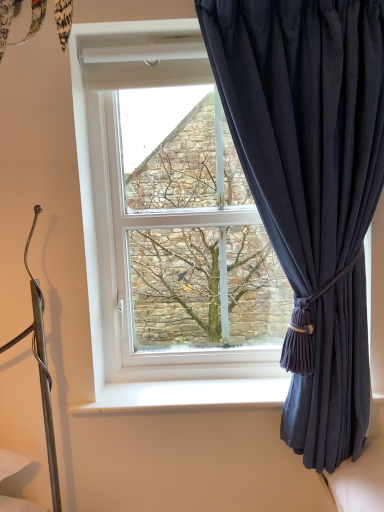
In order to click on green textured tree at center in this screenshot , I will do `click(206, 285)`.

Are green textured tree at center and dark blue fabric curtain at right far apart?

No, green textured tree at center is not far away from dark blue fabric curtain at right.

From a real-world perspective, is green textured tree at center located higher than dark blue fabric curtain at right?

Yes, from a real-world perspective, green textured tree at center is on top of dark blue fabric curtain at right.

Considering the sizes of objects green textured tree at center and dark blue fabric curtain at right in the image provided, who is shorter, green textured tree at center or dark blue fabric curtain at right?

green textured tree at center.

From the picture: Which of these two, green textured tree at center or dark blue fabric curtain at right, is bigger?

With larger size is dark blue fabric curtain at right.

Could you tell me if white plastic window sill at lower center is turned towards dark blue fabric curtain at right?

Yes, white plastic window sill at lower center is facing dark blue fabric curtain at right.

Between white plastic window sill at lower center and dark blue fabric curtain at right, which one has larger width?

Wider between the two is dark blue fabric curtain at right.

Is white plastic window sill at lower center inside or outside of dark blue fabric curtain at right?

white plastic window sill at lower center lies outside dark blue fabric curtain at right.

Is white plastic window sill at lower center closer to the viewer compared to dark blue fabric curtain at right?

No.

Is dark blue fabric curtain at right smaller than white plastic window sill at lower center?

Incorrect, dark blue fabric curtain at right is not smaller in size than white plastic window sill at lower center.

Can you tell me how much dark blue fabric curtain at right and white plastic window sill at lower center differ in facing direction?

The angular difference between dark blue fabric curtain at right and white plastic window sill at lower center is 1.59 degrees.

Is dark blue fabric curtain at right further to the viewer compared to white plastic window sill at lower center?

No, dark blue fabric curtain at right is in front of white plastic window sill at lower center.

Can you confirm if dark blue fabric curtain at right is taller than white plastic window sill at lower center?

Yes.

Does point (229, 331) lie in front of point (127, 391)?

No, (229, 331) is behind (127, 391).

From a real-world perspective, which is physically below, green textured tree at center or white plastic window sill at lower center?

Answer: white plastic window sill at lower center, from a real-world perspective.

Is green textured tree at center smaller than white plastic window sill at lower center?

No, green textured tree at center is not smaller than white plastic window sill at lower center.

At what (x,y) coordinates should I click in order to perform the action: click on window sill below the green textured tree at center (from the image's perspective). Please return your answer as a coordinate pair (x, y). The height and width of the screenshot is (512, 384). Looking at the image, I should click on (187, 395).

Is white plastic window sill at lower center taller than green textured tree at center?

No.

Which of these two, white plastic window sill at lower center or green textured tree at center, is thinner?

green textured tree at center.

Considering the sizes of objects white plastic window sill at lower center and green textured tree at center in the image provided, who is bigger, white plastic window sill at lower center or green textured tree at center?

green textured tree at center is bigger.

Looking at this image, from a real-world perspective, is white plastic window sill at lower center physically located above or below green textured tree at center?

From a real-world perspective, white plastic window sill at lower center is physically below green textured tree at center.

Is dark blue fabric curtain at right bigger or smaller than green textured tree at center?

In the image, dark blue fabric curtain at right appears to be larger than green textured tree at center.

Which is behind, point (317, 231) or point (138, 202)?

Point (138, 202)

Which of these two, dark blue fabric curtain at right or green textured tree at center, stands taller?

With more height is dark blue fabric curtain at right.

Are dark blue fabric curtain at right and green textured tree at center beside each other?

No, dark blue fabric curtain at right is not next to green textured tree at center.

This screenshot has height=512, width=384. I want to click on curtain that is below the green textured tree at center (from the image's perspective), so click(311, 188).

The image size is (384, 512). Identify the location of window sill behind the dark blue fabric curtain at right. (187, 395).

From the image, which object appears to be nearer to white plastic window sill at lower center, dark blue fabric curtain at right or green textured tree at center?

green textured tree at center lies closer to white plastic window sill at lower center than the other object.

Estimate the real-world distances between objects in this image. Which object is further from white plastic window sill at lower center, green textured tree at center or dark blue fabric curtain at right?

dark blue fabric curtain at right is further to white plastic window sill at lower center.

From the image, which object appears to be farther from dark blue fabric curtain at right, green textured tree at center or white plastic window sill at lower center?

white plastic window sill at lower center is further to dark blue fabric curtain at right.

Which object lies nearer to the anchor point dark blue fabric curtain at right, white plastic window sill at lower center or green textured tree at center?

Among the two, green textured tree at center is located nearer to dark blue fabric curtain at right.

Estimate the real-world distances between objects in this image. Which object is further from green textured tree at center, white plastic window sill at lower center or dark blue fabric curtain at right?

Among the two, white plastic window sill at lower center is located further to green textured tree at center.

From the image, which object appears to be nearer to green textured tree at center, dark blue fabric curtain at right or white plastic window sill at lower center?

dark blue fabric curtain at right.

This screenshot has height=512, width=384. Identify the location of curtain between green textured tree at center and white plastic window sill at lower center vertically. (311, 188).